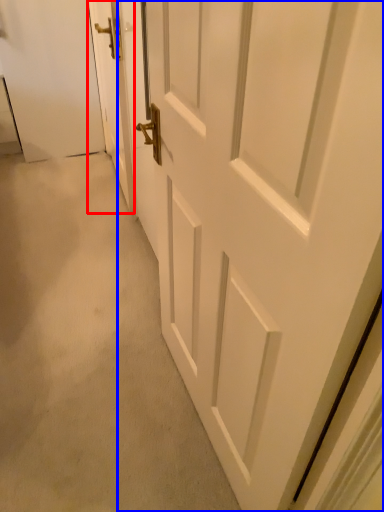
Question: Which object is further to the camera taking this photo, door (highlighted by a red box) or door (highlighted by a blue box)?

Choices:
 (A) door
 (B) door

Answer: (A)